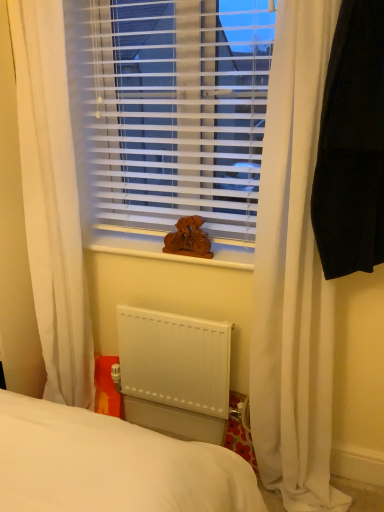
Where is `vacant area that lies between wooden statue at center and white plastic blinds at center`? The height and width of the screenshot is (512, 384). vacant area that lies between wooden statue at center and white plastic blinds at center is located at coordinates (135, 248).